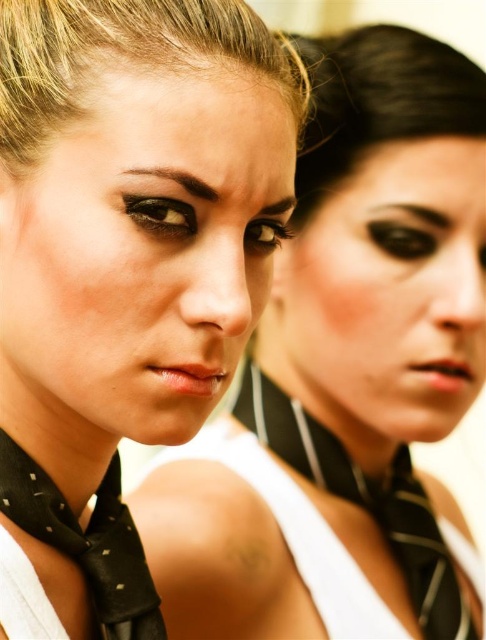
You are a tailor measuring accessories for a photoshoot. The matte black scarf at center and the black dotted silk tie at lower left need to be placed on a mannequin. Given that the mannequin has a neck circumference of 14 inches, can both accessories fit side by side without overlapping?

The distance between the matte black scarf at center and the black dotted silk tie at lower left is 5.68 inches. Since the mannequin has a neck circumference of 14 inches, there is sufficient space for both accessories to fit side by side without overlapping.

You are a photographer adjusting the lighting for a portrait session. You notice two matte black scarves in the scene. Which scarf is closer to the camera, the matte black scarf at center or the matte black scarf at left?

The matte black scarf at left is closer to the camera because the matte black scarf at center is positioned under it.